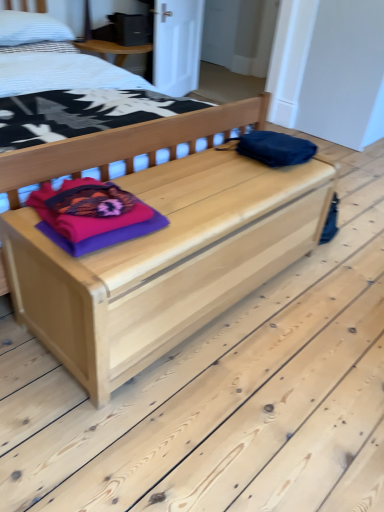
This screenshot has height=512, width=384. Describe the element at coordinates (158, 241) in the screenshot. I see `natural wood chest at center` at that location.

Where is `natural wood chest at center`? The width and height of the screenshot is (384, 512). natural wood chest at center is located at coordinates (158, 241).

From a real-world perspective, is purple fabric at center beneath natural wood bed at center?

Indeed, from a real-world perspective, purple fabric at center is positioned beneath natural wood bed at center.

Which of these two, purple fabric at center or natural wood bed at center, is thinner?

purple fabric at center is thinner.

Where is `material that appears on the right of natural wood bed at center`? Image resolution: width=384 pixels, height=512 pixels. material that appears on the right of natural wood bed at center is located at coordinates (92, 215).

Are purple fabric at center and natural wood bed at center located far from each other?

Yes.

Which is closer to the camera, (x=16, y=23) or (x=60, y=199)?

Point (x=16, y=23) is positioned farther from the camera compared to point (x=60, y=199).

Identify the location of material lying below the white textured pillow at upper left (from the image's perspective). This screenshot has height=512, width=384. (92, 215).

Considering the sizes of white textured pillow at upper left and purple fabric at center in the image, is white textured pillow at upper left wider or thinner than purple fabric at center?

white textured pillow at upper left is wider than purple fabric at center.

Can you confirm if white textured pillow at upper left is smaller than purple fabric at center?

No.

Who is taller, white textured pillow at upper left or natural wood bed at center?

natural wood bed at center is taller.

Is white textured pillow at upper left with natural wood bed at center?

No, white textured pillow at upper left is not in contact with natural wood bed at center.

Is point (15, 39) farther from camera compared to point (0, 282)?

That is True.

Can you confirm if natural wood bed at center is positioned to the left of natural wood chest at center?

Correct, you'll find natural wood bed at center to the left of natural wood chest at center.

Based on their sizes in the image, would you say natural wood bed at center is bigger or smaller than natural wood chest at center?

In the image, natural wood bed at center appears to be larger than natural wood chest at center.

Are natural wood bed at center and natural wood chest at center beside each other?

They are not placed beside each other.

Who is smaller, natural wood bed at center or purple fabric at center?

With smaller size is purple fabric at center.

Does natural wood bed at center have a greater height compared to purple fabric at center?

Yes.

Which is closer, (x=76, y=174) or (x=78, y=243)?

Positioned in front is point (x=78, y=243).

Does natural wood bed at center touch purple fabric at center?

They are not placed beside each other.

Looking at the image, does natural wood chest at center seem bigger or smaller compared to natural wood bed at center?

natural wood chest at center is smaller than natural wood bed at center.

Is natural wood chest at center facing towards natural wood bed at center?

No, natural wood chest at center is not turned towards natural wood bed at center.

Can you confirm if natural wood chest at center is positioned to the left of natural wood bed at center?

Incorrect, natural wood chest at center is not on the left side of natural wood bed at center.

In order to click on pillow above the purple fabric at center (from a real-world perspective) in this screenshot , I will do `click(31, 28)`.

In terms of size, does purple fabric at center appear bigger or smaller than white textured pillow at upper left?

In the image, purple fabric at center appears to be smaller than white textured pillow at upper left.

Does purple fabric at center turn towards white textured pillow at upper left?

No, purple fabric at center is not turned towards white textured pillow at upper left.

From a real-world perspective, is purple fabric at center positioned above or below white textured pillow at upper left?

purple fabric at center is below white textured pillow at upper left.

You are a GUI agent. You are given a task and a screenshot of the screen. Output one action in this format:
    pyautogui.click(x=<x>, y=<y>)
    Task: Click on the material that appears on the right of natural wood bed at center
    The width and height of the screenshot is (384, 512).
    Given the screenshot: What is the action you would take?
    pyautogui.click(x=92, y=215)

The height and width of the screenshot is (512, 384). What are the coordinates of `material that appears below the white textured pillow at upper left (from the image's perspective)` in the screenshot? It's located at (92, 215).

Looking at the image, which one is located further to white textured pillow at upper left, natural wood chest at center or natural wood bed at center?

Among the two, natural wood chest at center is located further to white textured pillow at upper left.

From the image, which object appears to be nearer to natural wood chest at center, white textured pillow at upper left or purple fabric at center?

The object closer to natural wood chest at center is purple fabric at center.

From the image, which object appears to be nearer to purple fabric at center, natural wood bed at center or natural wood chest at center?

natural wood chest at center lies closer to purple fabric at center than the other object.

Estimate the real-world distances between objects in this image. Which object is closer to purple fabric at center, natural wood chest at center or white textured pillow at upper left?

natural wood chest at center is closer to purple fabric at center.

Looking at the image, which one is located further to white textured pillow at upper left, purple fabric at center or natural wood bed at center?

Based on the image, purple fabric at center appears to be further to white textured pillow at upper left.

In the scene shown: When comparing their distances from natural wood bed at center, does purple fabric at center or natural wood chest at center seem closer?

The object closer to natural wood bed at center is natural wood chest at center.

Considering their positions, is white textured pillow at upper left positioned further to natural wood bed at center than purple fabric at center?

The object further to natural wood bed at center is purple fabric at center.

Considering their positions, is natural wood bed at center positioned further to purple fabric at center than white textured pillow at upper left?

white textured pillow at upper left.

Find the location of a particular element. The width and height of the screenshot is (384, 512). table between natural wood bed at center and white textured pillow at upper left along the z-axis is located at coordinates (158, 241).

I want to click on material positioned between natural wood bed at center and white textured pillow at upper left from near to far, so click(92, 215).

The image size is (384, 512). In order to click on material that lies between white textured pillow at upper left and natural wood chest at center from top to bottom in this screenshot , I will do `click(92, 215)`.

This screenshot has height=512, width=384. I want to click on material between natural wood bed at center and natural wood chest at center in the up-down direction, so click(92, 215).